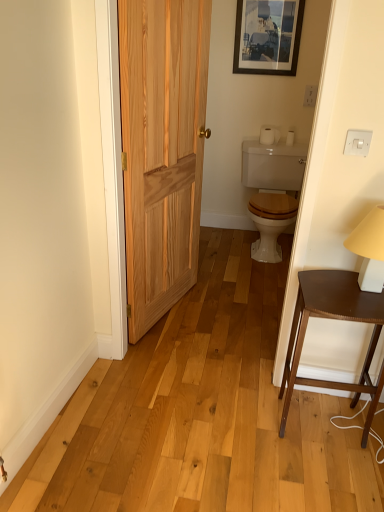
Question: Visually, is white matte toilet paper at upper right, which appears as the 2th toilet paper when viewed from the left, positioned to the left or to the right of white matte table lamp at right?

Choices:
 (A) right
 (B) left

Answer: (A)

Question: Looking at the image, does white matte toilet paper at upper right, positioned as the 1th toilet paper in right-to-left order, seem bigger or smaller compared to white matte table lamp at right?

Choices:
 (A) small
 (B) big

Answer: (A)

Question: Which of these objects is positioned closest to the wooden picture frame at upper center?

Choices:
 (A) white plastic outlet at upper right, the first electric outlet positioned from the back
 (B) white plastic switch at upper right, which is the 2th electric outlet in back-to-front order
 (C) natural wood door at left
 (D) white glossy toilet at center
 (E) white matte toilet paper at upper right, which appears as the 2th toilet paper when viewed from the left

Answer: (A)

Question: Which is farther from the white matte table lamp at right?

Choices:
 (A) white glossy toilet at center
 (B) white matte toilet paper at upper center, which is counted as the 2th toilet paper, starting from the right
 (C) white plastic switch at upper right, which is the 1th electric outlet in front-to-back order
 (D) white matte toilet paper at upper right, which appears as the 2th toilet paper when viewed from the left
 (E) white plastic outlet at upper right, the first electric outlet positioned from the right

Answer: (B)